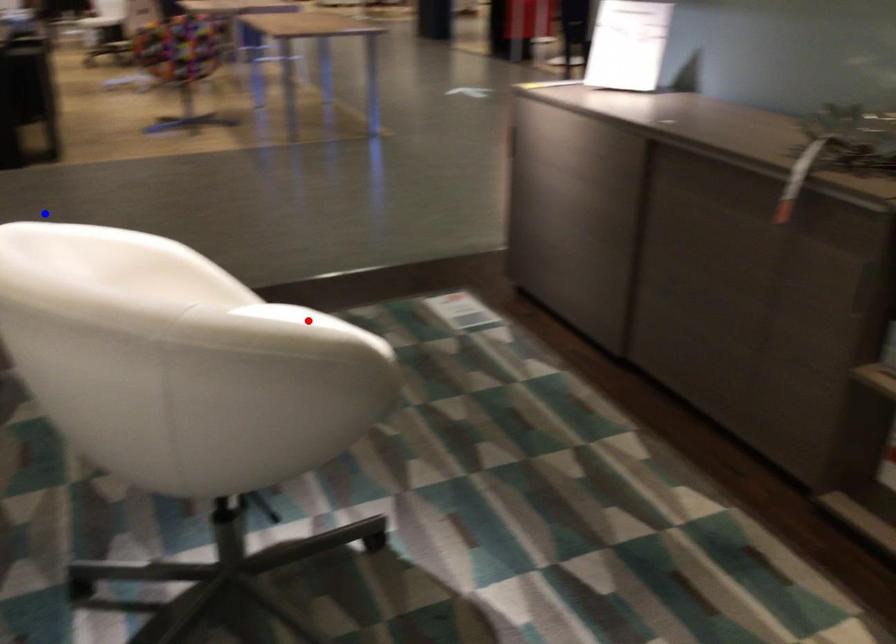
Question: In the image, two points are highlighted. Which point is nearer to the camera? Reply with the corresponding letter.

Choices:
 (A) blue point
 (B) red point

Answer: (A)